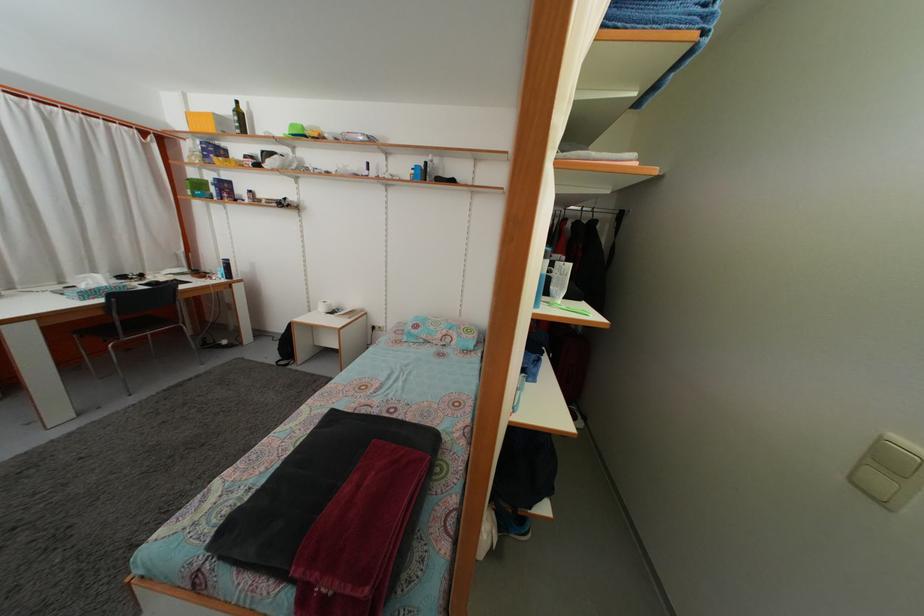
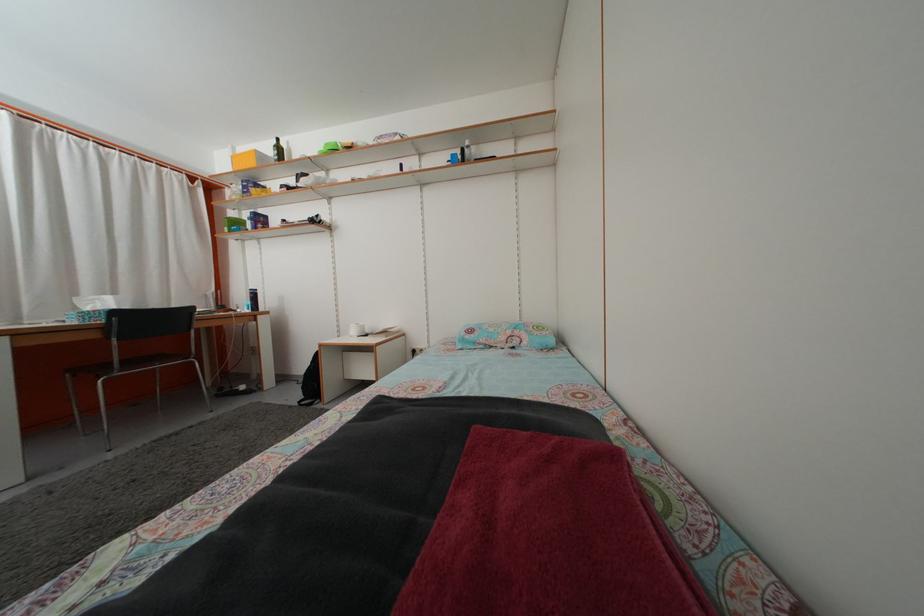
Consider the image. Which direction would the cameraman need to move to produce the second image?

The cameraman moved toward left, forward.